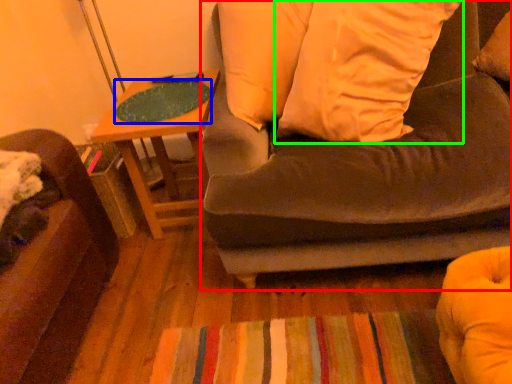
Question: Which object is the closest to the studio couch (highlighted by a red box)? Choose among these: table top (highlighted by a blue box) or pillow (highlighted by a green box).

Choices:
 (A) table top
 (B) pillow

Answer: (B)